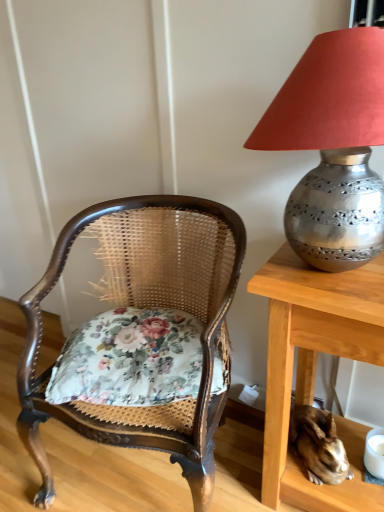
Image resolution: width=384 pixels, height=512 pixels. I want to click on floral fabric cushion at center, so click(130, 359).

Image resolution: width=384 pixels, height=512 pixels. I want to click on shiny metallic rabbit at lower right, so click(x=319, y=445).

Identify the location of wooden cane chair with floral cushion at left. [x=143, y=307].

In the scene shown: Is shiny metallic rabbit at lower right turned away from metallic silver lampshade at upper right?

No, shiny metallic rabbit at lower right is not facing away from metallic silver lampshade at upper right.

At what (x,y) coordinates should I click in order to perform the action: click on lamp above the shiny metallic rabbit at lower right (from a real-world perspective). Please return your answer as a coordinate pair (x, y). The image size is (384, 512). Looking at the image, I should click on (332, 147).

From a real-world perspective, is shiny metallic rabbit at lower right physically located above or below metallic silver lampshade at upper right?

shiny metallic rabbit at lower right is below metallic silver lampshade at upper right.

Measure the distance between shiny metallic rabbit at lower right and metallic silver lampshade at upper right.

They are 28.08 inches apart.

From the image's perspective, between floral fabric cushion at center and metallic silver lampshade at upper right, which one is located above?

metallic silver lampshade at upper right is shown above in the image.

Considering the sizes of objects floral fabric cushion at center and metallic silver lampshade at upper right in the image provided, who is bigger, floral fabric cushion at center or metallic silver lampshade at upper right?

metallic silver lampshade at upper right.

Can you confirm if floral fabric cushion at center is wider than metallic silver lampshade at upper right?

Yes.

What's the angular difference between floral fabric cushion at center and metallic silver lampshade at upper right's facing directions?

The facing directions of floral fabric cushion at center and metallic silver lampshade at upper right are 23.6 degrees apart.

Based on their positions, is metallic silver lampshade at upper right located to the left or right of shiny metallic rabbit at lower right?

Clearly, metallic silver lampshade at upper right is on the left of shiny metallic rabbit at lower right in the image.

Is metallic silver lampshade at upper right positioned beyond the bounds of shiny metallic rabbit at lower right?

metallic silver lampshade at upper right lies outside shiny metallic rabbit at lower right's area.

How many degrees apart are the facing directions of metallic silver lampshade at upper right and shiny metallic rabbit at lower right?

They differ by 43.4 degrees in their facing directions.

Considering the relative positions of wooden cane chair with floral cushion at left and floral fabric cushion at center in the image provided, is wooden cane chair with floral cushion at left to the left or to the right of floral fabric cushion at center?

From the image, it's evident that wooden cane chair with floral cushion at left is to the right of floral fabric cushion at center.

From the image's perspective, relative to floral fabric cushion at center, is wooden cane chair with floral cushion at left above or below?

From the image's perspective, wooden cane chair with floral cushion at left appears below floral fabric cushion at center.

Looking at the image, does wooden cane chair with floral cushion at left seem bigger or smaller compared to floral fabric cushion at center?

Clearly, wooden cane chair with floral cushion at left is larger in size than floral fabric cushion at center.

Which is behind, point (345, 130) or point (62, 377)?

Positioned behind is point (62, 377).

Considering the sizes of objects metallic silver lampshade at upper right and floral fabric cushion at center in the image provided, who is taller, metallic silver lampshade at upper right or floral fabric cushion at center?

metallic silver lampshade at upper right.

Which object is closer to the camera, metallic silver lampshade at upper right or floral fabric cushion at center?

metallic silver lampshade at upper right is closer to the camera.

Is metallic silver lampshade at upper right in contact with floral fabric cushion at center?

metallic silver lampshade at upper right and floral fabric cushion at center are clearly separated.

From a real-world perspective, which is physically below, metallic silver lampshade at upper right or wooden cane chair with floral cushion at left?

wooden cane chair with floral cushion at left is physically lower.

Looking at this image, is there a large distance between metallic silver lampshade at upper right and wooden cane chair with floral cushion at left?

metallic silver lampshade at upper right is near wooden cane chair with floral cushion at left, not far away.

Can you confirm if metallic silver lampshade at upper right is wider than wooden cane chair with floral cushion at left?

No.

The image size is (384, 512). In order to click on lamp above the wooden cane chair with floral cushion at left (from the image's perspective) in this screenshot , I will do `click(332, 147)`.

The image size is (384, 512). In order to click on chair above the shiny metallic rabbit at lower right (from a real-world perspective) in this screenshot , I will do `click(143, 307)`.

Which object is positioned more to the right, wooden cane chair with floral cushion at left or shiny metallic rabbit at lower right?

Positioned to the right is shiny metallic rabbit at lower right.

Would you say wooden cane chair with floral cushion at left is a long distance from shiny metallic rabbit at lower right?

No, there isn't a large distance between wooden cane chair with floral cushion at left and shiny metallic rabbit at lower right.

Can you tell me how much wooden cane chair with floral cushion at left and shiny metallic rabbit at lower right differ in facing direction?

wooden cane chair with floral cushion at left and shiny metallic rabbit at lower right are facing 32.6 degrees away from each other.

At what (x,y) coordinates should I click in order to perform the action: click on lamp above the shiny metallic rabbit at lower right (from the image's perspective). Please return your answer as a coordinate pair (x, y). The image size is (384, 512). Looking at the image, I should click on (332, 147).

The width and height of the screenshot is (384, 512). In order to click on pillow below the metallic silver lampshade at upper right (from the image's perspective) in this screenshot , I will do `click(130, 359)`.

From the image, which object appears to be farther from metallic silver lampshade at upper right, floral fabric cushion at center or shiny metallic rabbit at lower right?

Among the two, shiny metallic rabbit at lower right is located further to metallic silver lampshade at upper right.

From the image, which object appears to be farther from wooden cane chair with floral cushion at left, shiny metallic rabbit at lower right or metallic silver lampshade at upper right?

Among the two, shiny metallic rabbit at lower right is located further to wooden cane chair with floral cushion at left.

Considering their positions, is wooden cane chair with floral cushion at left positioned further to shiny metallic rabbit at lower right than floral fabric cushion at center?

wooden cane chair with floral cushion at left lies further to shiny metallic rabbit at lower right than the other object.

Based on their spatial positions, is floral fabric cushion at center or shiny metallic rabbit at lower right further from wooden cane chair with floral cushion at left?

Based on the image, shiny metallic rabbit at lower right appears to be further to wooden cane chair with floral cushion at left.

Based on their spatial positions, is shiny metallic rabbit at lower right or wooden cane chair with floral cushion at left closer to metallic silver lampshade at upper right?

wooden cane chair with floral cushion at left is positioned closer to the anchor metallic silver lampshade at upper right.

When comparing their distances from shiny metallic rabbit at lower right, does wooden cane chair with floral cushion at left or metallic silver lampshade at upper right seem further?

Based on the image, metallic silver lampshade at upper right appears to be further to shiny metallic rabbit at lower right.

From the image, which object appears to be farther from floral fabric cushion at center, shiny metallic rabbit at lower right or wooden cane chair with floral cushion at left?

Among the two, shiny metallic rabbit at lower right is located further to floral fabric cushion at center.

From the image, which object appears to be nearer to shiny metallic rabbit at lower right, metallic silver lampshade at upper right or floral fabric cushion at center?

floral fabric cushion at center lies closer to shiny metallic rabbit at lower right than the other object.

This screenshot has width=384, height=512. I want to click on pillow between metallic silver lampshade at upper right and shiny metallic rabbit at lower right from top to bottom, so click(130, 359).

Where is `chair between floral fabric cushion at center and shiny metallic rabbit at lower right in the horizontal direction`? This screenshot has width=384, height=512. chair between floral fabric cushion at center and shiny metallic rabbit at lower right in the horizontal direction is located at coordinates (143, 307).

Where is `pillow that lies between metallic silver lampshade at upper right and wooden cane chair with floral cushion at left from top to bottom`? pillow that lies between metallic silver lampshade at upper right and wooden cane chair with floral cushion at left from top to bottom is located at coordinates (130, 359).

I want to click on chair between metallic silver lampshade at upper right and shiny metallic rabbit at lower right vertically, so click(x=143, y=307).